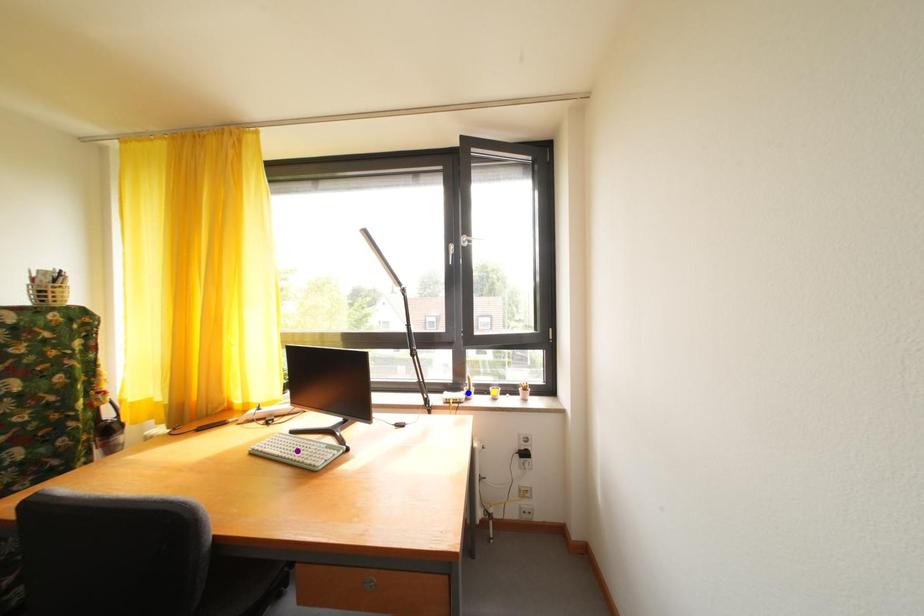
Order these from nearest to farthest:
A) purple point
B) blue point
C) yellow point

purple point → blue point → yellow point